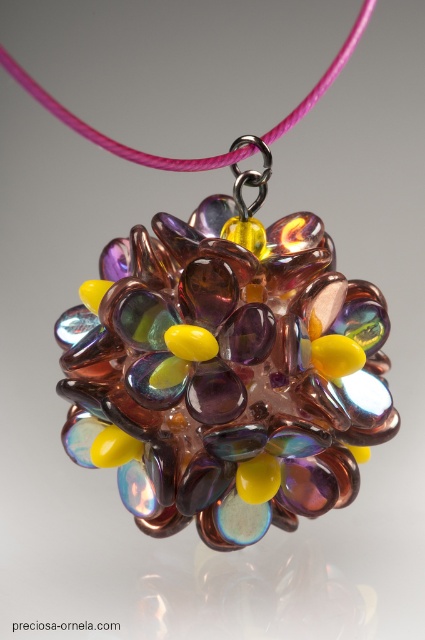
Can you confirm if pink cord at upper center is bigger than translucent yellow glass bead at center?

Correct, pink cord at upper center is larger in size than translucent yellow glass bead at center.

Who is higher up, pink cord at upper center or translucent yellow glass bead at center?

Positioned higher is pink cord at upper center.

This screenshot has height=640, width=425. Find the location of `pink cord at upper center`. pink cord at upper center is located at coordinates (110, 138).

Find the location of a particular element. pink cord at upper center is located at coordinates (110, 138).